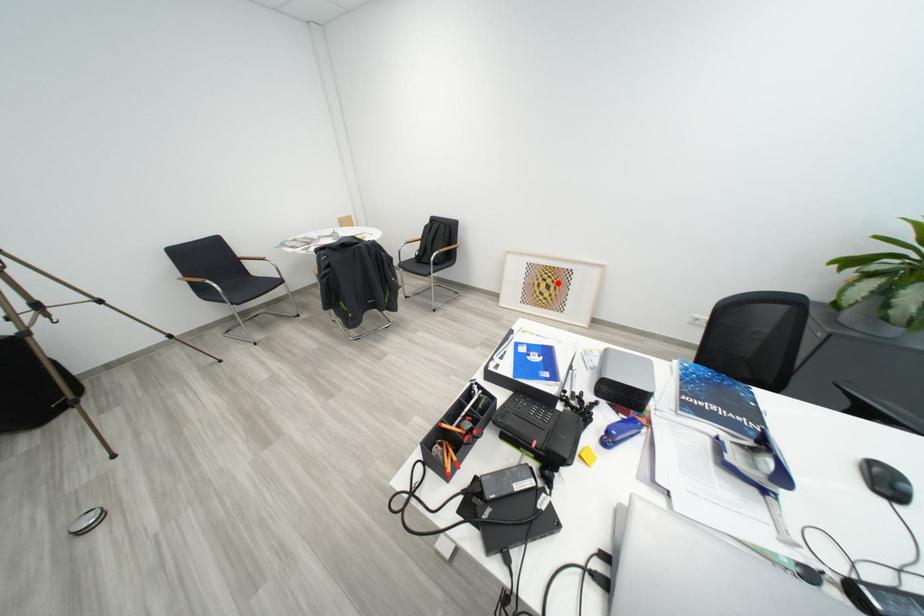
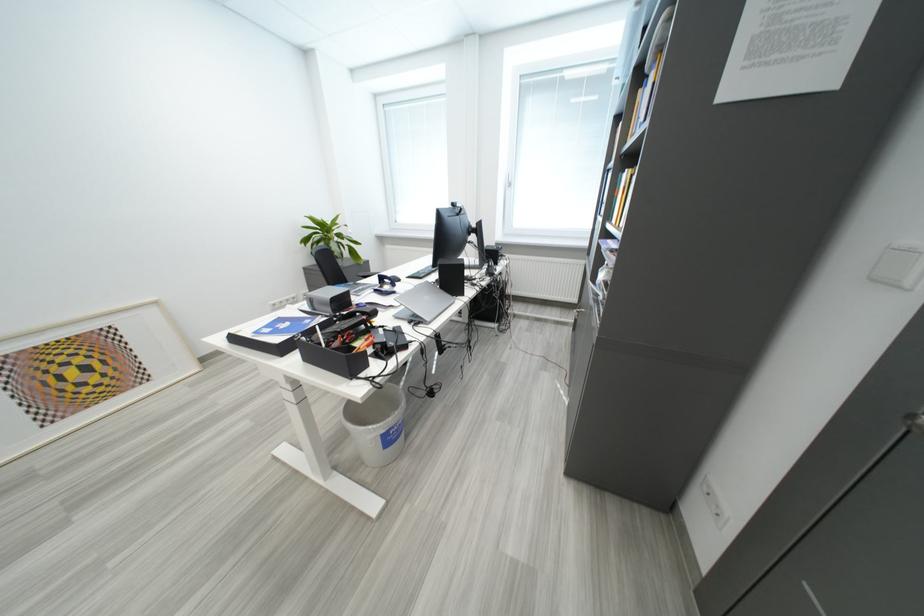
In the second image, find the point that corresponds to the highlighted location in the first image.

(88, 363)